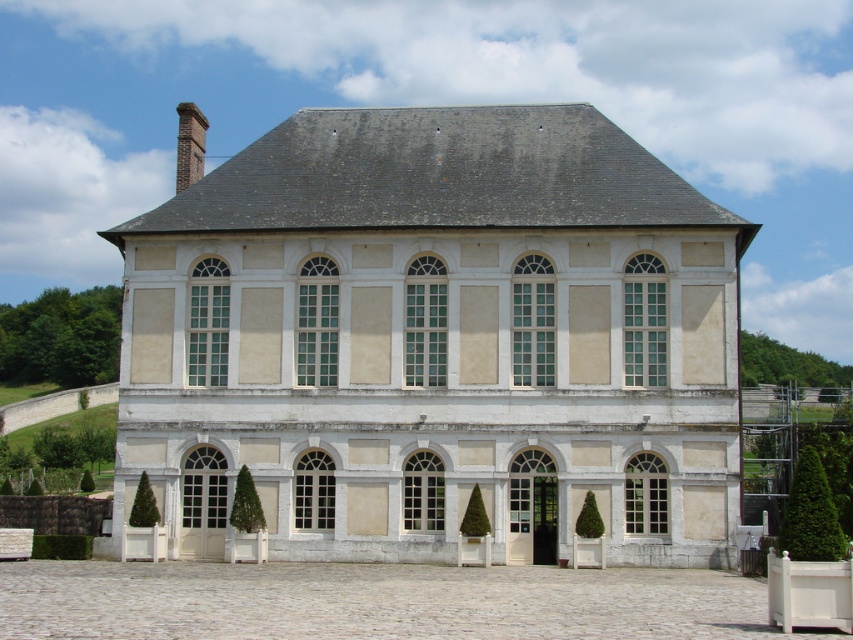
You are standing in front of a grand two story building with a symmetrical facade. You notice a point marked at coordinates (438, 340). Which object in the scene is exactly at that location?

The beige stone palace at center is located at point (438, 340).

Consider the image. You are an architect reviewing the blueprint of a classical building. The beige stone palace at center and the brick chimney at upper left are both part of the design. Based on their spatial relationship, which object takes up more area on the blueprint?

The brick chimney at upper left occupies more space than the beige stone palace at center according to the blueprint.

You are standing in front of the beige stone palace at center. What are the coordinates of the palace?

The beige stone palace at center is located at coordinates point (438, 340).